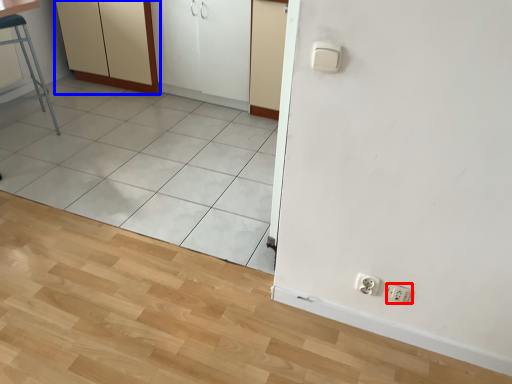
Question: Which object is closer to the camera taking this photo, socket (highlighted by a red box) or dresser (highlighted by a blue box)?

Choices:
 (A) socket
 (B) dresser

Answer: (A)